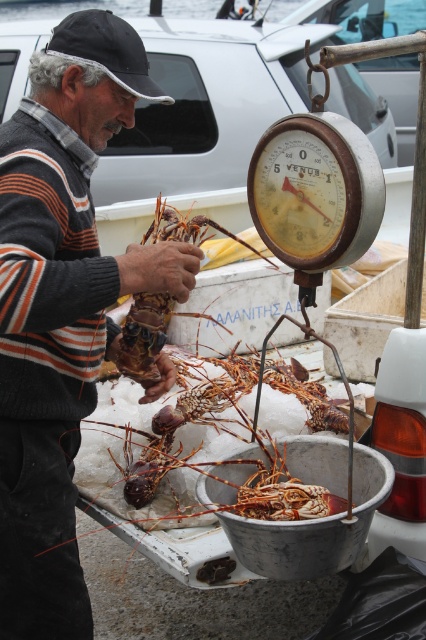
Who is positioned more to the right, striped sweater at center or orange rough lobster at center?

orange rough lobster at center

Is striped sweater at center shorter than orange rough lobster at center?

In fact, striped sweater at center may be taller than orange rough lobster at center.

Identify the location of striped sweater at center. (62, 307).